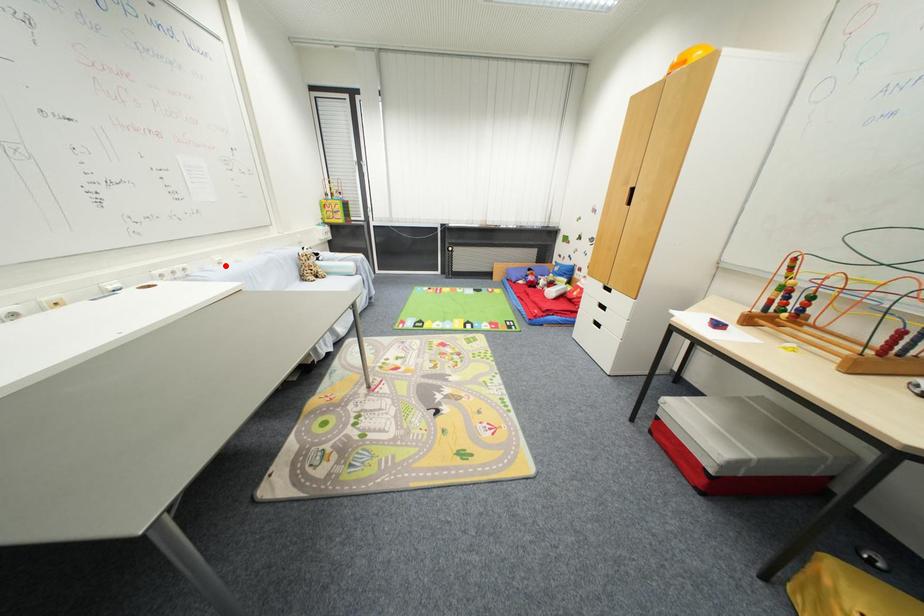
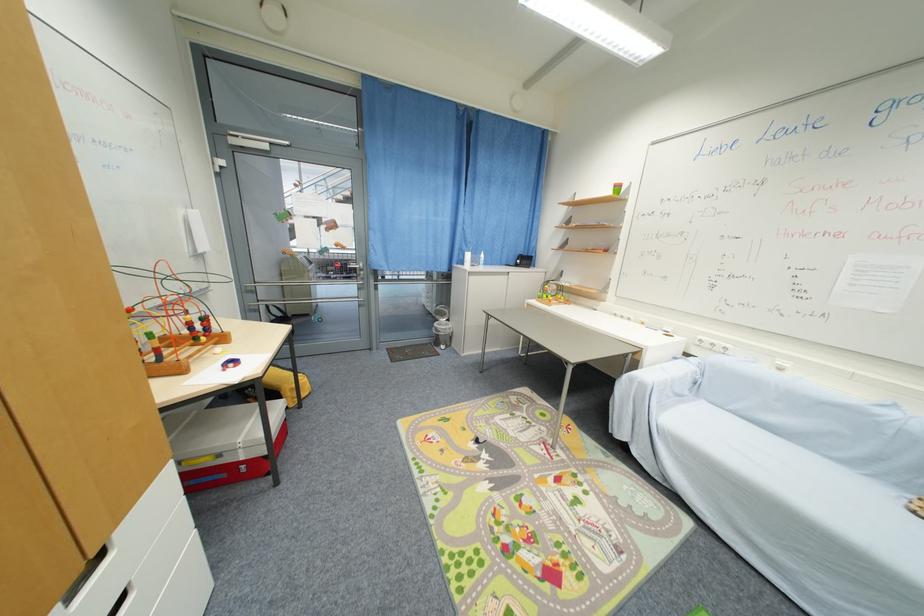
In the second image, find the point that corresponds to the highlighted location in the first image.

(785, 371)